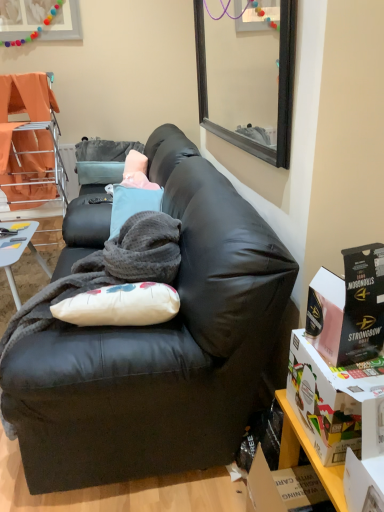
Describe the element at coordinates (18, 251) in the screenshot. I see `light blue plastic desk at lower left` at that location.

What is the approximate width of orange fabric chair at left?

The width of orange fabric chair at left is 23.11 inches.

Image resolution: width=384 pixels, height=512 pixels. Find the location of `matte cardboard box at lower right, arranged as the first box when ordered from the bottom`. matte cardboard box at lower right, arranged as the first box when ordered from the bottom is located at coordinates (336, 402).

Describe the element at coordinates (348, 307) in the screenshot. I see `matte black box at right, marked as the 1th box in a top-to-bottom arrangement` at that location.

Identify the location of matte black box at right, which is the second box from bottom to top. (348, 307).

Identify the location of light blue plastic desk at lower left. The image size is (384, 512). (18, 251).

Based on their sizes in the image, would you say wooden shelf at lower right is bigger or smaller than soft gray blanket at center?

wooden shelf at lower right is smaller than soft gray blanket at center.

Would you consider wooden shelf at lower right to be distant from soft gray blanket at center?

wooden shelf at lower right is near soft gray blanket at center, not far away.

Which is closer to the camera, (x=330, y=470) or (x=107, y=244)?

The point (x=330, y=470) is closer.

Is wooden shelf at lower right not inside soft gray blanket at center?

wooden shelf at lower right is positioned outside soft gray blanket at center.

Could you measure the distance between soft gray blanket at center and matte black box at right, which is the second box from bottom to top?

A distance of 26.22 inches exists between soft gray blanket at center and matte black box at right, which is the second box from bottom to top.

From the image's perspective, which is below, soft gray blanket at center or matte black box at right, marked as the 1th box in a top-to-bottom arrangement?

soft gray blanket at center, from the image's perspective.

Considering the sizes of objects soft gray blanket at center and matte black box at right, which is the second box from bottom to top, in the image provided, who is shorter, soft gray blanket at center or matte black box at right, which is the second box from bottom to top,?

With less height is matte black box at right, which is the second box from bottom to top.

Considering the sizes of soft gray blanket at center and matte black box at right, which is the second box from bottom to top, in the image, is soft gray blanket at center wider or thinner than matte black box at right, which is the second box from bottom to top,?

soft gray blanket at center is wider than matte black box at right, which is the second box from bottom to top.

At what (x,y) coordinates should I click in order to perform the action: click on table below the matte cardboard box at lower right, positioned as the 2th box in top-to-bottom order (from the image's perspective). Please return your answer as a coordinate pair (x, y). The width and height of the screenshot is (384, 512). Looking at the image, I should click on (308, 454).

From the image's perspective, between matte cardboard box at lower right, arranged as the first box when ordered from the bottom, and wooden shelf at lower right, who is located below?

wooden shelf at lower right is shown below in the image.

Is the surface of matte cardboard box at lower right, positioned as the 2th box in top-to-bottom order, in direct contact with wooden shelf at lower right?

No, matte cardboard box at lower right, positioned as the 2th box in top-to-bottom order, is not making contact with wooden shelf at lower right.

In terms of height, does matte cardboard box at lower right, arranged as the first box when ordered from the bottom, look taller or shorter compared to wooden shelf at lower right?

In the image, matte cardboard box at lower right, arranged as the first box when ordered from the bottom, appears to be shorter than wooden shelf at lower right.

Does matte black box at right, marked as the 1th box in a top-to-bottom arrangement, turn towards matte black couch at center?

No, matte black box at right, marked as the 1th box in a top-to-bottom arrangement, is not facing towards matte black couch at center.

Is matte black box at right, marked as the 1th box in a top-to-bottom arrangement, directly adjacent to matte black couch at center?

There is a gap between matte black box at right, marked as the 1th box in a top-to-bottom arrangement, and matte black couch at center.

Considering the relative sizes of matte black box at right, marked as the 1th box in a top-to-bottom arrangement, and matte black couch at center in the image provided, is matte black box at right, marked as the 1th box in a top-to-bottom arrangement, thinner than matte black couch at center?

Yes.

In the scene shown: Based on their positions, is matte black box at right, which is the second box from bottom to top, located to the left or right of matte black couch at center?

matte black box at right, which is the second box from bottom to top, is positioned on matte black couch at center's right side.

How many degrees apart are the facing directions of light blue plastic desk at lower left and orange fabric chair at left?

3.09 degrees.

Does light blue plastic desk at lower left have a smaller size compared to orange fabric chair at left?

Correct, light blue plastic desk at lower left occupies less space than orange fabric chair at left.

From the picture: Is orange fabric chair at left at the back of light blue plastic desk at lower left?

No.

How distant is light blue plastic desk at lower left from orange fabric chair at left?

light blue plastic desk at lower left and orange fabric chair at left are 31.61 inches apart from each other.

Find the location of a particular element. This screenshot has height=512, width=384. blanket on the left of wooden shelf at lower right is located at coordinates (106, 271).

Considering the positions of objects soft gray blanket at center and wooden shelf at lower right in the image provided, who is more to the left, soft gray blanket at center or wooden shelf at lower right?

soft gray blanket at center.

Would you consider soft gray blanket at center to be distant from wooden shelf at lower right?

soft gray blanket at center is near wooden shelf at lower right, not far away.

From the picture: In the image, is soft gray blanket at center positioned in front of or behind wooden shelf at lower right?

soft gray blanket at center is positioned farther from the viewer than wooden shelf at lower right.

Is there a large distance between wooden shelf at lower right and matte black box at right, which is the second box from bottom to top?

wooden shelf at lower right is near matte black box at right, which is the second box from bottom to top, not far away.

Is wooden shelf at lower right located outside matte black box at right, marked as the 1th box in a top-to-bottom arrangement?

wooden shelf at lower right is positioned outside matte black box at right, marked as the 1th box in a top-to-bottom arrangement.

Based on their positions, is wooden shelf at lower right located to the left or right of matte black box at right, which is the second box from bottom to top?

wooden shelf at lower right is to the left of matte black box at right, which is the second box from bottom to top.

From their relative heights in the image, would you say wooden shelf at lower right is taller or shorter than matte black box at right, marked as the 1th box in a top-to-bottom arrangement?

In the image, wooden shelf at lower right appears to be taller than matte black box at right, marked as the 1th box in a top-to-bottom arrangement.

Locate an element on the screen. blanket behind the wooden shelf at lower right is located at coordinates (106, 271).

At what (x,y) coordinates should I click in order to perform the action: click on box located above the soft gray blanket at center (from the image's perspective). Please return your answer as a coordinate pair (x, y). This screenshot has height=512, width=384. Looking at the image, I should click on (348, 307).

Which object lies nearer to the anchor point wooden shelf at lower right, matte black box at right, marked as the 1th box in a top-to-bottom arrangement, or orange fabric chair at left?

matte black box at right, marked as the 1th box in a top-to-bottom arrangement, is closer to wooden shelf at lower right.

Looking at the image, which one is located further to matte black box at right, marked as the 1th box in a top-to-bottom arrangement, matte black couch at center or light blue plastic desk at lower left?

light blue plastic desk at lower left is positioned further to the anchor matte black box at right, marked as the 1th box in a top-to-bottom arrangement.

Estimate the real-world distances between objects in this image. Which object is closer to orange fabric chair at left, soft gray blanket at center or light blue plastic desk at lower left?

light blue plastic desk at lower left is positioned closer to the anchor orange fabric chair at left.

Estimate the real-world distances between objects in this image. Which object is closer to wooden shelf at lower right, matte black box at right, which is the second box from bottom to top, or matte black couch at center?

Based on the image, matte black box at right, which is the second box from bottom to top, appears to be nearer to wooden shelf at lower right.

Looking at the image, which one is located further to soft gray blanket at center, matte cardboard box at lower right, arranged as the first box when ordered from the bottom, or matte black box at right, which is the second box from bottom to top?

matte black box at right, which is the second box from bottom to top, is positioned further to the anchor soft gray blanket at center.

In the scene shown: Considering their positions, is matte cardboard box at lower right, arranged as the first box when ordered from the bottom, positioned further to wooden shelf at lower right than soft gray blanket at center?

Based on the image, soft gray blanket at center appears to be further to wooden shelf at lower right.

When comparing their distances from soft gray blanket at center, does matte cardboard box at lower right, positioned as the 2th box in top-to-bottom order, or matte black couch at center seem further?

Based on the image, matte cardboard box at lower right, positioned as the 2th box in top-to-bottom order, appears to be further to soft gray blanket at center.

When comparing their distances from soft gray blanket at center, does wooden shelf at lower right or matte cardboard box at lower right, arranged as the first box when ordered from the bottom, seem closer?

matte cardboard box at lower right, arranged as the first box when ordered from the bottom, is positioned closer to the anchor soft gray blanket at center.

Image resolution: width=384 pixels, height=512 pixels. What are the coordinates of `blanket between matte black couch at center and wooden shelf at lower right in the vertical direction` in the screenshot? It's located at (x=106, y=271).

Identify the location of desk between soft gray blanket at center and orange fabric chair at left in the front-back direction. (18, 251).

Locate an element on the screen. The image size is (384, 512). blanket between light blue plastic desk at lower left and wooden shelf at lower right from left to right is located at coordinates (106, 271).

The width and height of the screenshot is (384, 512). I want to click on table located between soft gray blanket at center and matte black box at right, which is the second box from bottom to top, in the left-right direction, so click(x=308, y=454).